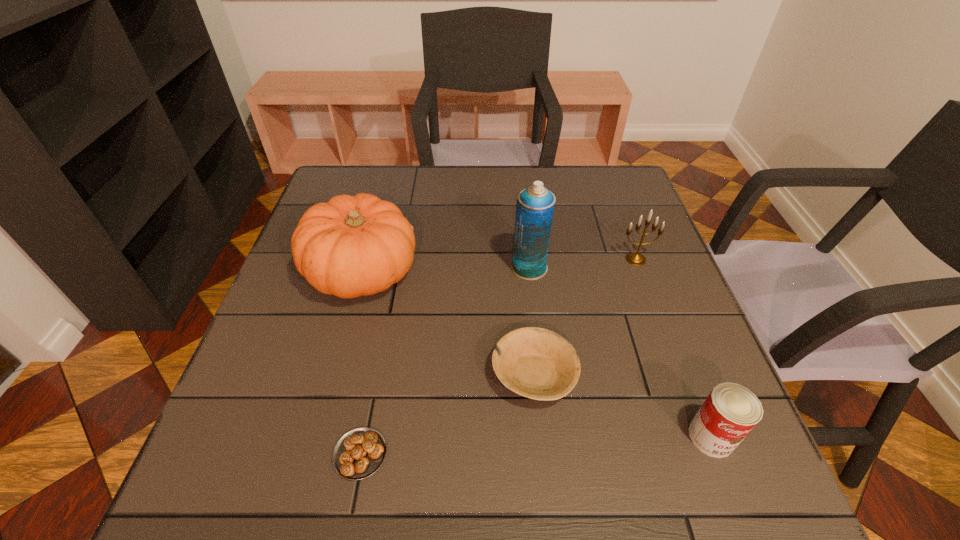
Image resolution: width=960 pixels, height=540 pixels. What are the coordinates of `the tallest object` in the screenshot? It's located at (535, 205).

At what (x,y) coordinates should I click in order to perform the action: click on pumpkin. Please return your answer as a coordinate pair (x, y). The image size is (960, 540). Looking at the image, I should click on (351, 246).

This screenshot has height=540, width=960. Identify the location of candelabrum. (635, 258).

At what (x,y) coordinates should I click in order to perform the action: click on can. Please return your answer as a coordinate pair (x, y). Looking at the image, I should click on (730, 412).

Locate an element on the screen. The height and width of the screenshot is (540, 960). bowl is located at coordinates (537, 363).

This screenshot has width=960, height=540. I want to click on the fifth tallest object, so click(x=537, y=363).

Where is `the shortest object`? The width and height of the screenshot is (960, 540). the shortest object is located at coordinates (359, 453).

Find the location of a particular element. The width and height of the screenshot is (960, 540). vacant space located on the left of the aerosol can is located at coordinates (438, 268).

This screenshot has height=540, width=960. What are the coordinates of `vacant region located 0.280m on the back of the pumpkin` in the screenshot? It's located at (388, 178).

Locate an element on the screen. This screenshot has width=960, height=540. blank space located on the back of the candelabrum is located at coordinates (613, 198).